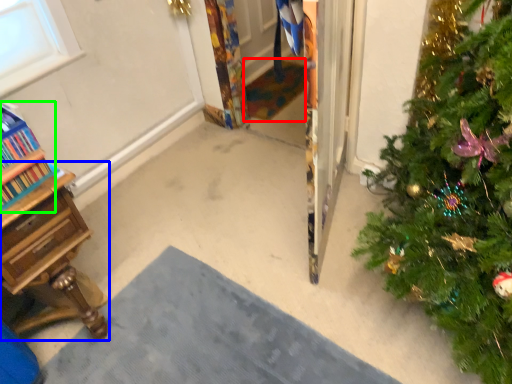
Question: Which is farther away from doormat (highlighted by a red box)? desk (highlighted by a blue box) or bookcase (highlighted by a green box)?

Choices:
 (A) desk
 (B) bookcase

Answer: (B)